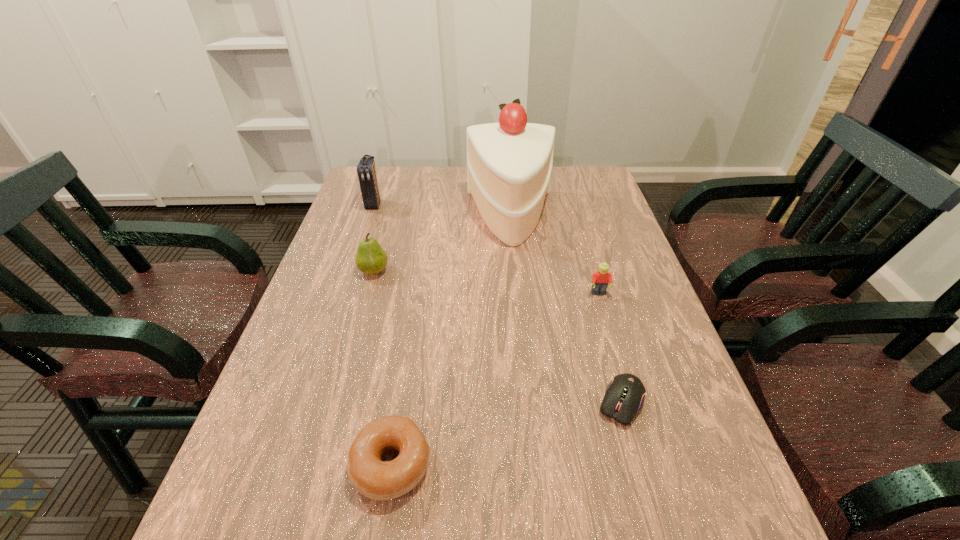
Where is `cake`? This screenshot has width=960, height=540. cake is located at coordinates (509, 164).

This screenshot has height=540, width=960. What are the coordinates of `clutch bag` in the screenshot? It's located at (366, 170).

This screenshot has width=960, height=540. I want to click on pear, so click(371, 258).

Identify the location of the third farthest object. This screenshot has height=540, width=960. (371, 258).

The image size is (960, 540). Find the location of `the third nearest object`. the third nearest object is located at coordinates (600, 279).

I want to click on the third shortest object, so click(600, 279).

Find the location of a particular element. Image resolution: width=960 pixels, height=540 pixels. the fifth tallest object is located at coordinates (373, 478).

I want to click on bagel, so click(x=373, y=478).

The height and width of the screenshot is (540, 960). I want to click on the fifth farthest object, so click(624, 396).

Where is `the shortest object`? Image resolution: width=960 pixels, height=540 pixels. the shortest object is located at coordinates point(624,396).